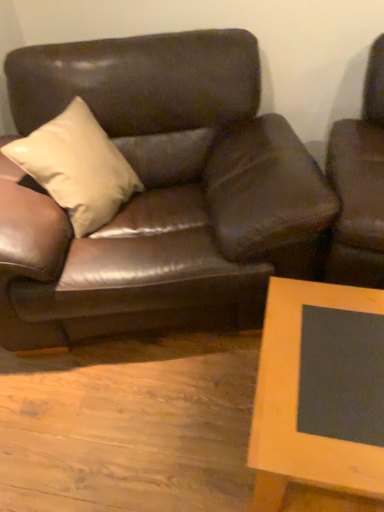
This screenshot has height=512, width=384. Identify the location of free point above wooden frame at lower right (from a real-world perspective). (332, 388).